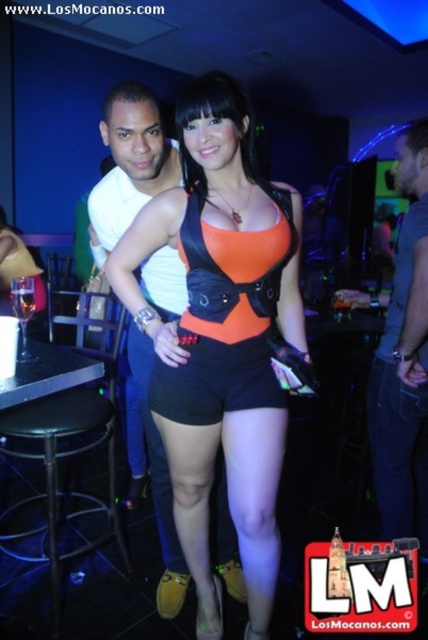
You are a bartender at the bar and need to reach the clear glass at bar left while standing near the black fabric shorts at center. Can you comfortably reach the glass without moving your position?

The black fabric shorts at center is 24.72 inches away from the clear glass at bar left. Since the average human arm length is around 25 inches, you can just barely reach the clear glass at bar left from the black fabric shorts at center.

You are standing in the nightclub scene described. You want to take a photo of the point at coordinates (181,227). Your camera has a focal length of 50mm and you are currently 2 meters away from the point. Should you move closer or farther away to focus properly?

The point at coordinates (181,227) is 1.33 meters from the camera. Since you are currently 2 meters away, you need to move closer to reduce the distance to approximately 1.33 meters for proper focus.

In the scene shown: You are a fashion designer observing the nightclub scene. You notice the orange matte bikini top at center and the black fabric shorts at center. Which of these two items has a narrower width?

The orange matte bikini top at center is thinner than the black fabric shorts at center, so the orange matte bikini top at center has a narrower width.